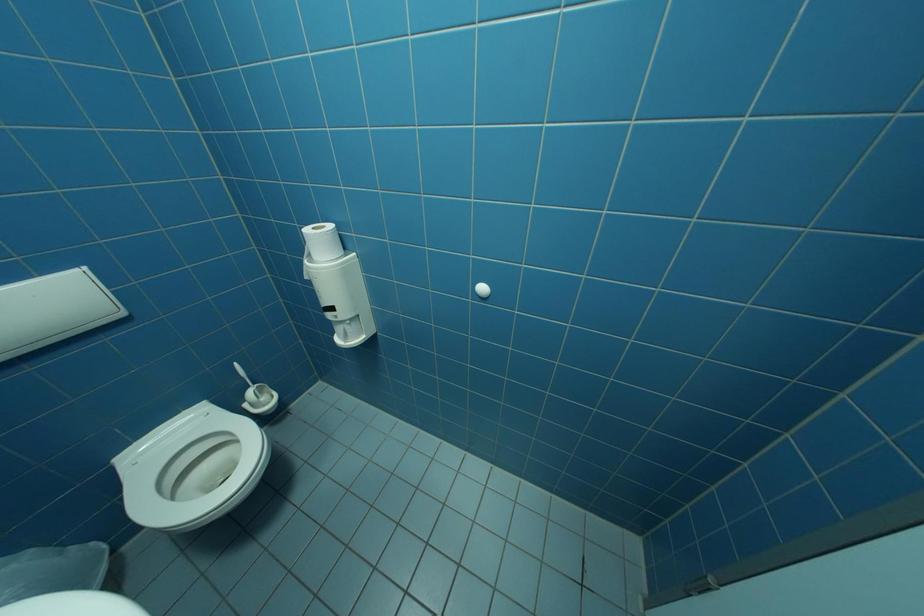
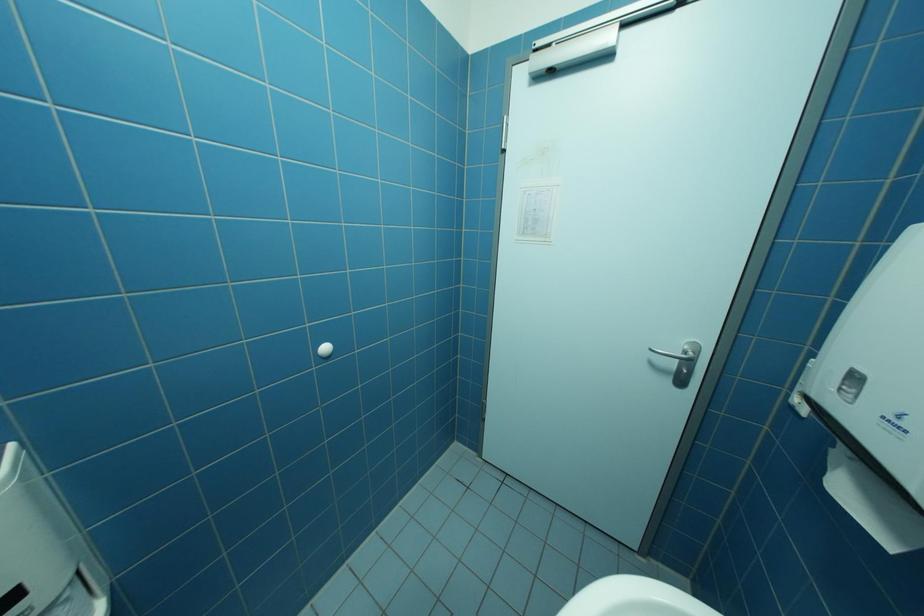
Question: The camera is either moving clockwise (left) or counter-clockwise (right) around the object. The first image is from the beginning of the video and the second image is from the end. Is the camera moving left or right when shooting the video?

Choices:
 (A) Left
 (B) Right

Answer: (A)